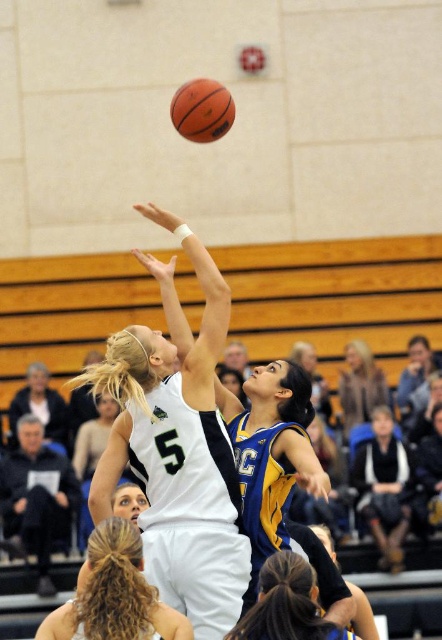
Between white jersey at center and brown leather jacket at upper right, which one is positioned higher?

Positioned higher is white jersey at center.

Can you confirm if white jersey at center is shorter than brown leather jacket at upper right?

No, white jersey at center is not shorter than brown leather jacket at upper right.

Where is `white jersey at center`? The image size is (442, 640). white jersey at center is located at coordinates (178, 454).

Does white jersey at center come behind blonde hair at center?

Yes, it is behind blonde hair at center.

Between white jersey at center and blonde hair at center, which one has more height?

Standing taller between the two is white jersey at center.

Where is `white jersey at center`? Image resolution: width=442 pixels, height=640 pixels. white jersey at center is located at coordinates (178, 454).

Who is more distant from viewer, (266, 592) or (187, 81)?

Point (187, 81)

Is blue jersey at center thinner than rubber textured basketball at center?

Yes, blue jersey at center is thinner than rubber textured basketball at center.

Does point (248, 628) lie in front of point (210, 88)?

Yes, point (248, 628) is closer to viewer.

The width and height of the screenshot is (442, 640). I want to click on blue jersey at center, so click(288, 604).